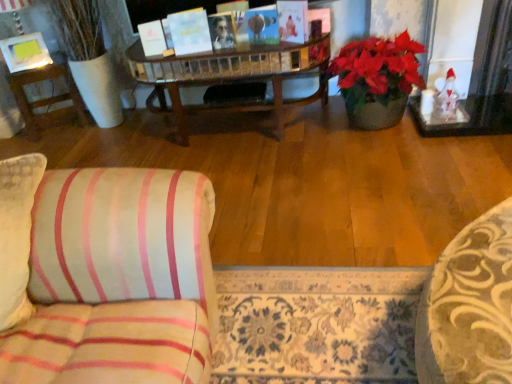
This screenshot has height=384, width=512. What are the coordinates of `free spot below wooden side table at left (from a real-world perspective)` in the screenshot? It's located at (59, 127).